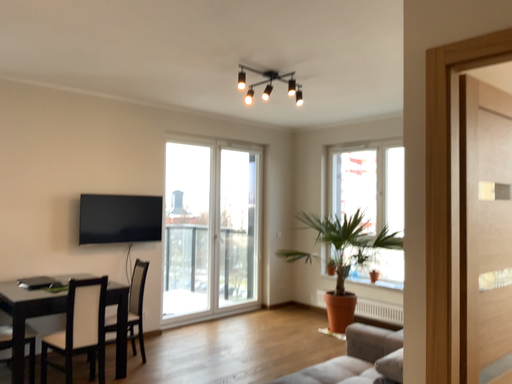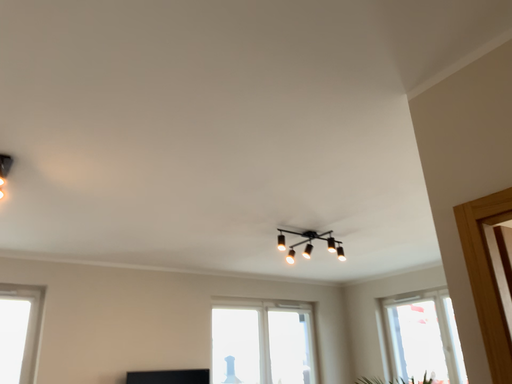
Question: Which way did the camera rotate in the video?

Choices:
 (A) rotated upward
 (B) rotated downward

Answer: (A)